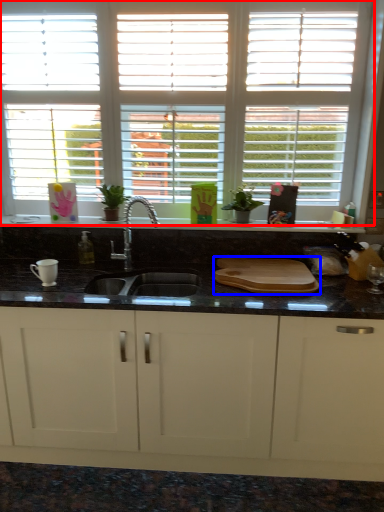
Question: Among these objects, which one is farthest to the camera, window (highlighted by a red box) or tray (highlighted by a blue box)?

Choices:
 (A) window
 (B) tray

Answer: (A)